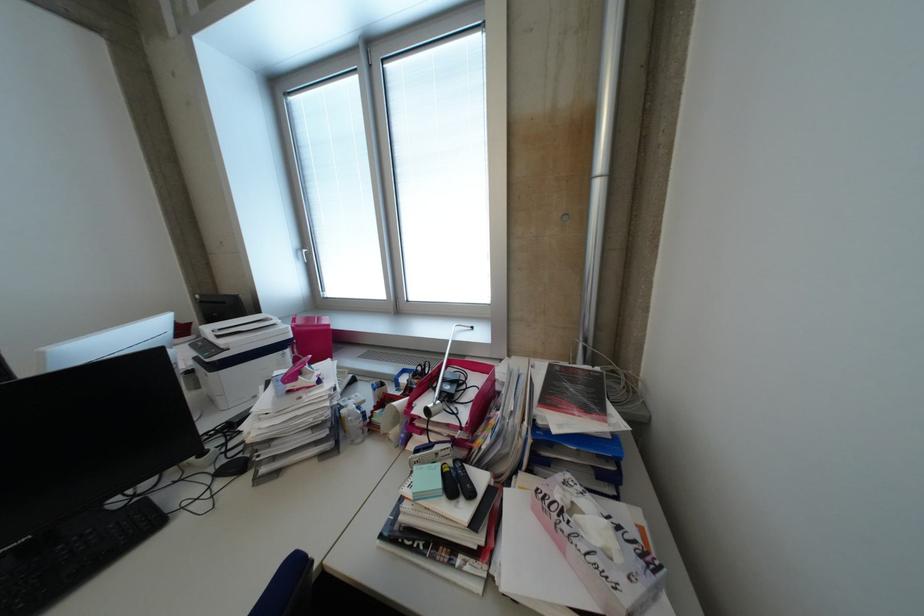
What are the coordinates of `white window handle` in the screenshot? It's located at (305, 254).